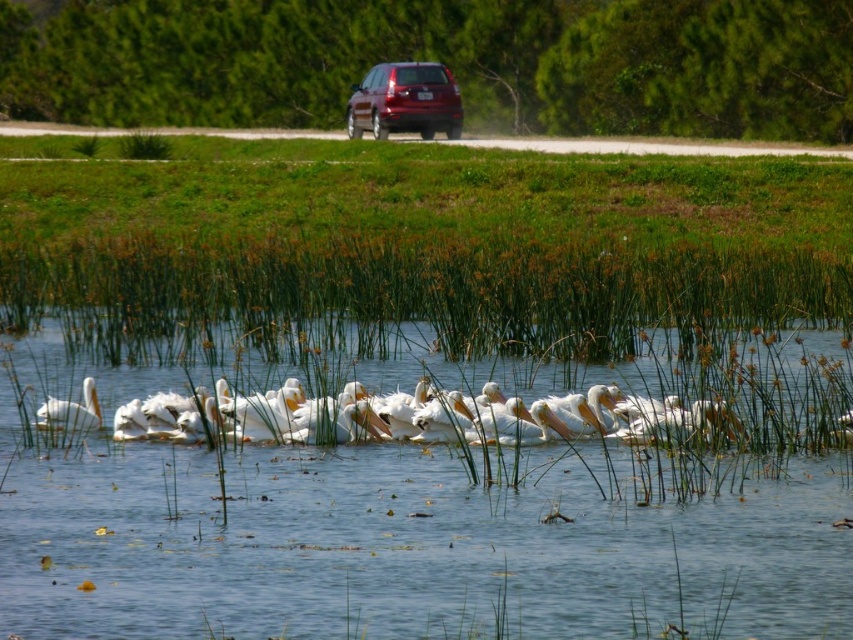
Question: Is shiny red suv at center positioned at the back of white matte pelican at left?

Choices:
 (A) no
 (B) yes

Answer: (B)

Question: Among these points, which one is nearest to the camera?

Choices:
 (A) (73, 426)
 (B) (407, 358)
 (C) (357, 115)

Answer: (A)

Question: Is clear water at center positioned behind white matte pelican at left?

Choices:
 (A) yes
 (B) no

Answer: (B)

Question: Considering the real-world distances, which object is closest to the shiny red suv at center?

Choices:
 (A) clear water at center
 (B) white matte pelican at left

Answer: (B)

Question: Considering the relative positions of shiny red suv at center and white matte pelican at left in the image provided, where is shiny red suv at center located with respect to white matte pelican at left?

Choices:
 (A) below
 (B) above

Answer: (B)

Question: Which of the following is the farthest from the observer?

Choices:
 (A) (212, 577)
 (B) (352, 96)
 (C) (85, 390)

Answer: (B)